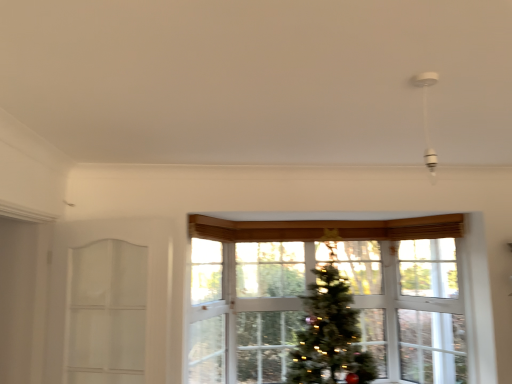
Measure the distance between point (249, 292) and camera.

Point (249, 292) and camera are 3.77 meters apart from each other.

The image size is (512, 384). Describe the element at coordinates (312, 281) in the screenshot. I see `clear glass window at center` at that location.

Image resolution: width=512 pixels, height=384 pixels. I want to click on clear glass window at center, so click(312, 281).

I want to click on white glass door at left, so click(106, 313).

What do you see at coordinates (106, 313) in the screenshot?
I see `white glass door at left` at bounding box center [106, 313].

Where is `clear glass window at center`? clear glass window at center is located at coordinates (312, 281).

Considering the relative positions of clear glass window at center and white glass door at left in the image provided, is clear glass window at center to the left of white glass door at left from the viewer's perspective?

Incorrect, clear glass window at center is not on the left side of white glass door at left.

Considering their positions, is clear glass window at center located in front of or behind white glass door at left?

Visually, clear glass window at center is located behind white glass door at left.

Does point (464, 279) come farther from viewer compared to point (72, 371)?

Yes, point (464, 279) is behind point (72, 371).

From the image's perspective, is clear glass window at center below white glass door at left?

Indeed, from the image's perspective, clear glass window at center is shown beneath white glass door at left.

From a real-world perspective, who is located higher, clear glass window at center or white glass door at left?

From a 3D spatial view, white glass door at left is above.

Considering the relative sizes of clear glass window at center and white glass door at left in the image provided, is clear glass window at center thinner than white glass door at left?

Incorrect, the width of clear glass window at center is not less than that of white glass door at left.

Considering the sizes of objects clear glass window at center and white glass door at left in the image provided, who is taller, clear glass window at center or white glass door at left?

With more height is clear glass window at center.

Can you confirm if clear glass window at center is smaller than white glass door at left?

No, clear glass window at center is not smaller than white glass door at left.

Looking at this image, would you say clear glass window at center is outside white glass door at left?

Yes, clear glass window at center is located beyond the bounds of white glass door at left.

Is the surface of clear glass window at center in direct contact with white glass door at left?

No, clear glass window at center is not next to white glass door at left.

Is clear glass window at center oriented away from white glass door at left?

No, white glass door at left is not at the back of clear glass window at center.

Can you tell me how much clear glass window at center and white glass door at left differ in facing direction?

The angle between the facing direction of clear glass window at center and the facing direction of white glass door at left is 17.5 degrees.

Measure the distance from clear glass window at center to white glass door at left.

1.15 meters.

Identify the location of screen door in front of the clear glass window at center. Image resolution: width=512 pixels, height=384 pixels. (x=106, y=313).

Considering the positions of objects white glass door at left and clear glass window at center in the image provided, who is more to the right, white glass door at left or clear glass window at center?

From the viewer's perspective, clear glass window at center appears more on the right side.

Relative to clear glass window at center, is white glass door at left in front or behind?

white glass door at left is in front of clear glass window at center.

Is point (99, 244) behind point (432, 246)?

No.

Looking at this image, from the image's perspective, is white glass door at left over clear glass window at center?

Yes, from the image's perspective, white glass door at left is on top of clear glass window at center.

From a real-world perspective, which is physically above, white glass door at left or clear glass window at center?

white glass door at left.

In the scene shown: Considering the relative sizes of white glass door at left and clear glass window at center in the image provided, is white glass door at left thinner than clear glass window at center?

Yes.

In terms of height, does white glass door at left look taller or shorter compared to clear glass window at center?

In the image, white glass door at left appears to be shorter than clear glass window at center.

Considering the relative sizes of white glass door at left and clear glass window at center in the image provided, is white glass door at left smaller than clear glass window at center?

Yes, white glass door at left is smaller than clear glass window at center.

Can clear glass window at center be found inside white glass door at left?

Definitely not — clear glass window at center is not inside white glass door at left.

Are white glass door at left and clear glass window at center making contact?

No.

Does white glass door at left turn towards clear glass window at center?

No, white glass door at left is not turned towards clear glass window at center.

Can you tell me how much white glass door at left and clear glass window at center differ in facing direction?

There is a 17.5-degree angle between the facing directions of white glass door at left and clear glass window at center.

The image size is (512, 384). In order to click on screen door positioned vertically above the clear glass window at center (from a real-world perspective) in this screenshot , I will do (106, 313).

Locate an element on the screen. window on the right side of white glass door at left is located at coordinates (312, 281).

In the image, there is a clear glass window at center. Identify the location of screen door above it (from the image's perspective). (106, 313).